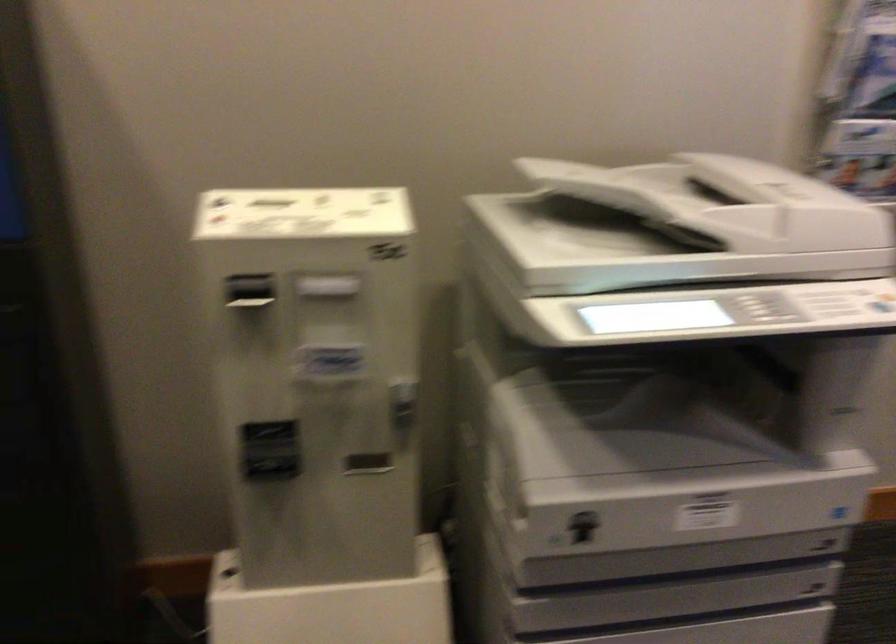
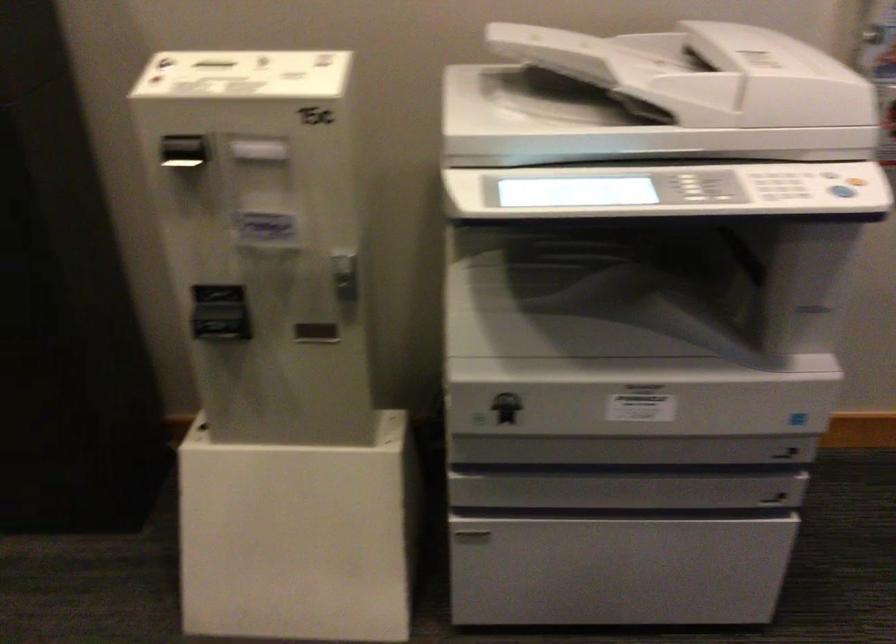
In the second image, find the point that corresponds to point (253, 294) in the first image.

(185, 156)